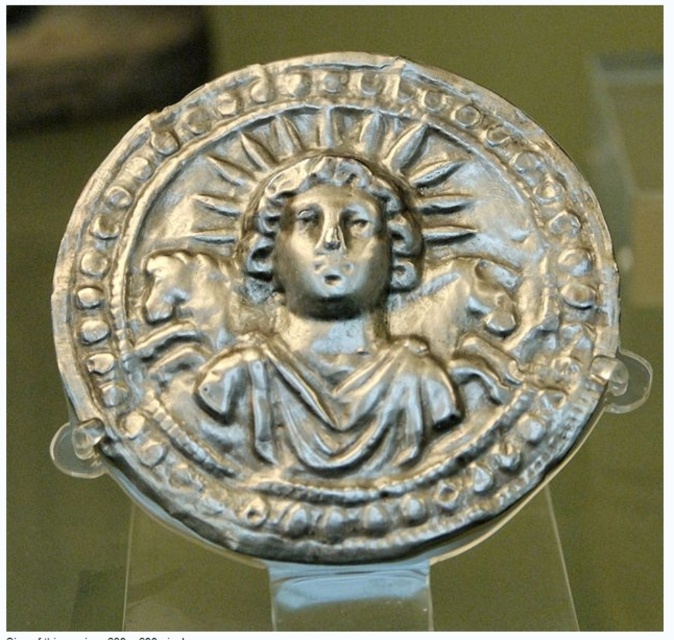
You are a museum visitor observing the shiny silver coin at center and the shiny silver head at center. Which object is closer to you?

The shiny silver coin at center is closer to you because it is in front of the shiny silver head at center.

You are a museum curator planning to install a protective glass cover over the shiny silver deity at center and the shiny silver head at center. The glass must be large enough to cover both objects without touching them. What is the minimum distance the glass should be from each object to ensure both are fully enclosed?

The minimum distance the glass should be from each object is 0.445 inches. Since the shiny silver deity at center and shiny silver head at center are 0.89 inches apart, placing the glass 0.445 inches away from each ensures both are enclosed without touching.